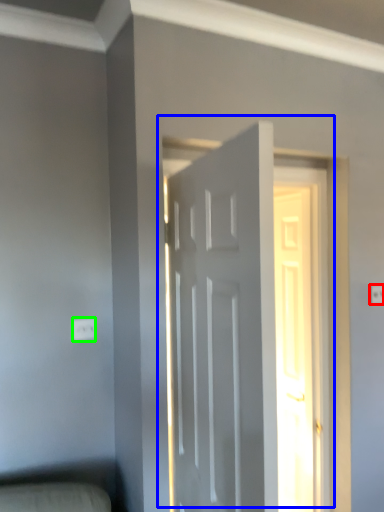
Question: Which object is positioned farthest from electric outlet (highlighted by a red box)? Select from door (highlighted by a blue box) and electric outlet (highlighted by a green box).

Choices:
 (A) door
 (B) electric outlet

Answer: (B)